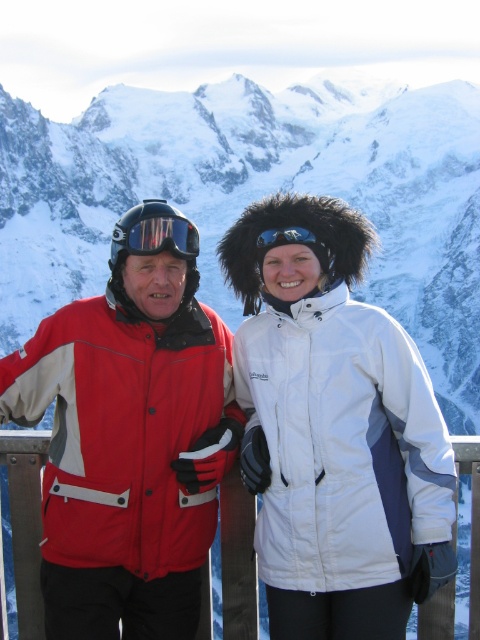
Question: Which object is farther from the camera taking this photo?

Choices:
 (A) matte black goggles at upper left
 (B) matte red jacket at center
 (C) snowy mountain at center
 (D) blue reflective goggles at center

Answer: (C)

Question: Is matte red jacket at center smaller than blue reflective goggles at center?

Choices:
 (A) no
 (B) yes

Answer: (A)

Question: Which object appears closest to the camera in this image?

Choices:
 (A) blue reflective goggles at center
 (B) matte red jacket at center
 (C) snowy mountain at center

Answer: (B)

Question: Which object is positioned farthest from the matte black goggles at upper left?

Choices:
 (A) snowy mountain at center
 (B) blue reflective goggles at center
 (C) matte red jacket at center

Answer: (A)

Question: Can you confirm if snowy mountain at center is bigger than blue reflective goggles at center?

Choices:
 (A) yes
 (B) no

Answer: (A)

Question: Does matte red jacket at center appear over blue reflective goggles at center?

Choices:
 (A) no
 (B) yes

Answer: (A)